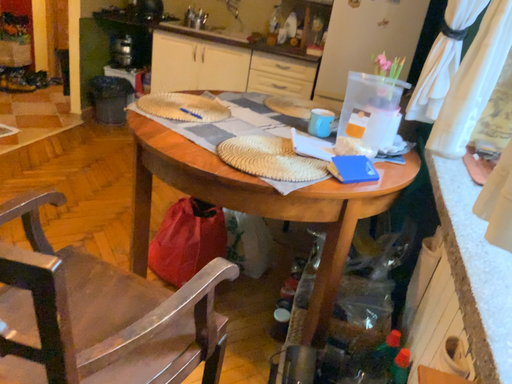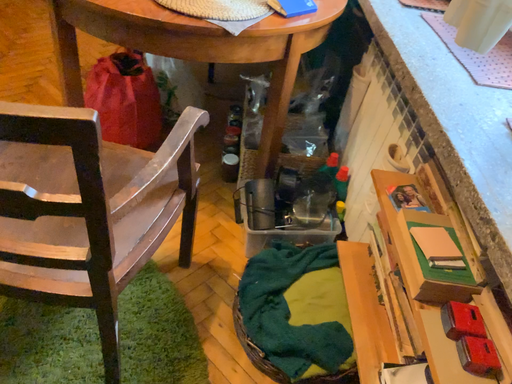
Question: Which way did the camera rotate in the video?

Choices:
 (A) rotated left
 (B) rotated right

Answer: (B)